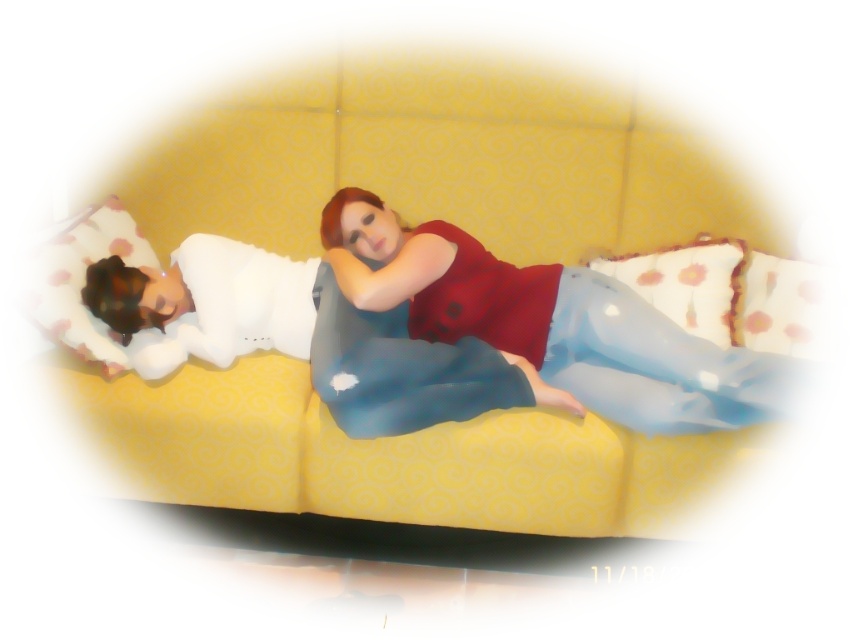
Question: Estimate the real-world distances between objects in this image. Which object is farther from the yellow fabric couch at center?

Choices:
 (A) white dotted fabric pillow at right
 (B) white dotted fabric pillow at upper right
 (C) matte red blouse at center

Answer: (A)

Question: Which point appears farthest from the camera in this image?

Choices:
 (A) (695, 492)
 (B) (786, 296)

Answer: (B)

Question: Is matte red blouse at center bigger than white dotted fabric pillow at right?

Choices:
 (A) no
 (B) yes

Answer: (B)

Question: Which point is farther to the camera?

Choices:
 (A) white dotted fabric pillow at right
 (B) white dotted fabric pillow at upper right

Answer: (B)

Question: Does matte red blouse at center appear on the left side of white dotted fabric pillow at upper right?

Choices:
 (A) yes
 (B) no

Answer: (A)

Question: Can you confirm if matte red blouse at center is positioned above white dotted fabric pillow at upper right?

Choices:
 (A) yes
 (B) no

Answer: (B)